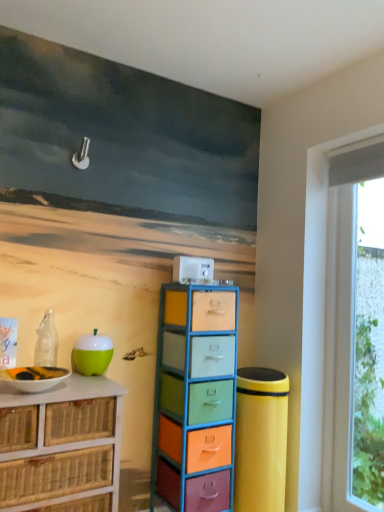
You are a GUI agent. You are given a task and a screenshot of the screen. Output one action in this format:
    pyautogui.click(x=<x>, y=<y>)
    Task: Click on the free space above transparent glass window at right (from a real-world perspective)
    The height and width of the screenshot is (512, 384).
    Given the screenshot: What is the action you would take?
    pyautogui.click(x=359, y=189)